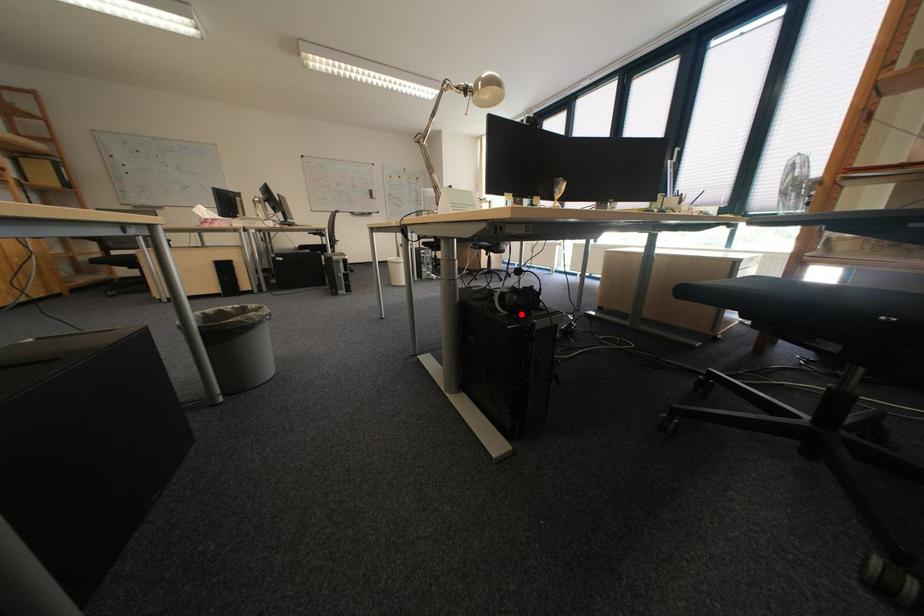
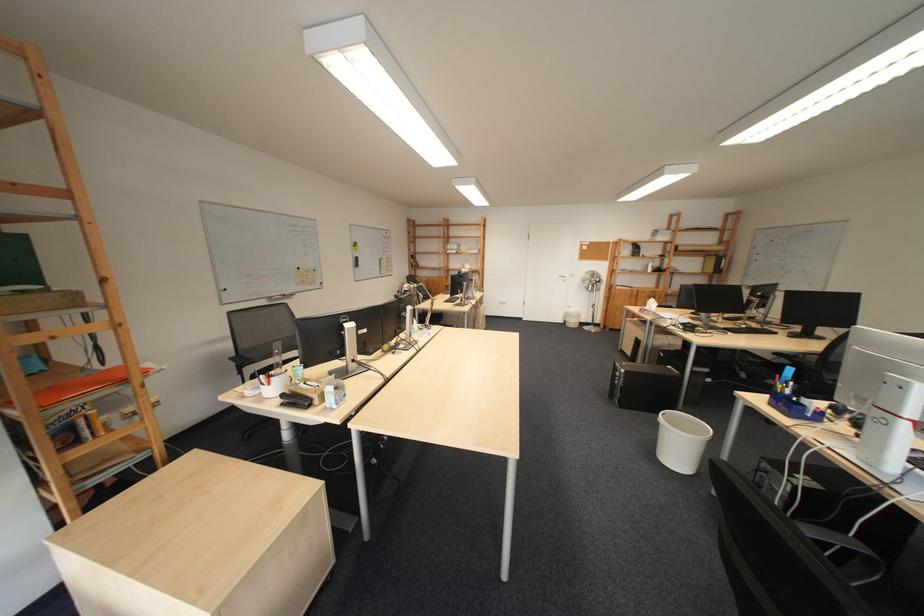
Question: I am providing you with two images of the same scene from different viewpoints. A red point is marked on the first image. Can you still see the location of the red point in image 2?

Choices:
 (A) Yes
 (B) No

Answer: (B)